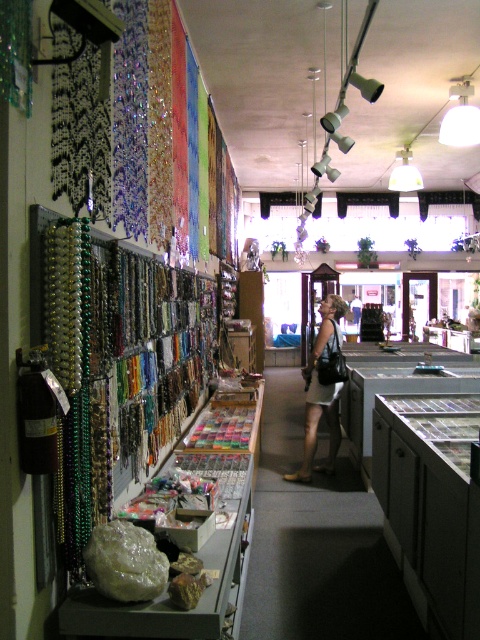
Between green matte beads at left and leather skirt at center, which one appears on the right side from the viewer's perspective?

leather skirt at center

Does green matte beads at left have a greater width compared to leather skirt at center?

No, green matte beads at left is not wider than leather skirt at center.

Is point (149, 440) positioned behind point (320, 396)?

No, (149, 440) is in front of (320, 396).

This screenshot has height=640, width=480. In order to click on green matte beads at left in this screenshot , I will do `click(117, 364)`.